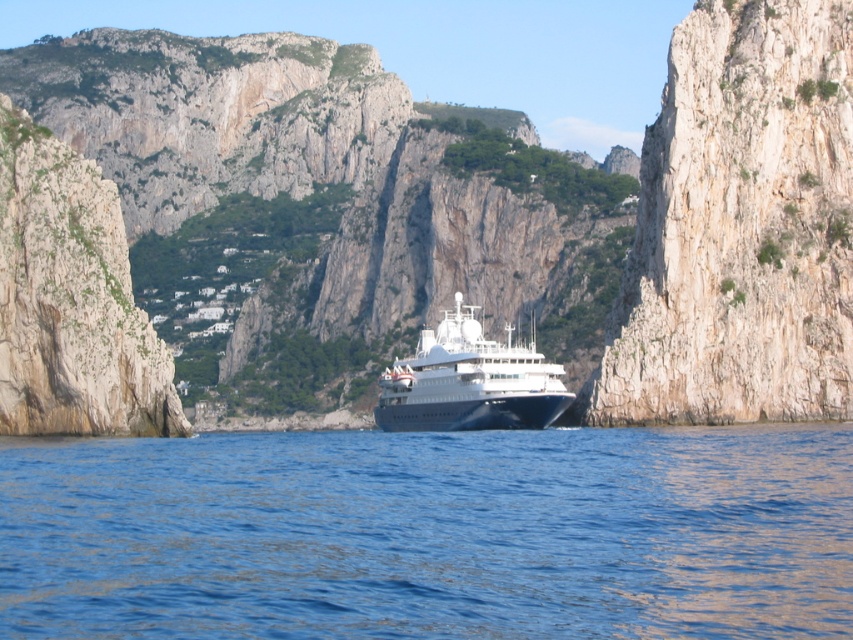
Question: Which object appears farthest from the camera in this image?

Choices:
 (A) blue liquid water at center
 (B) white stone mountain at center
 (C) white glossy cruise ship at center

Answer: (C)

Question: Where is white stone mountain at center located in relation to white glossy cruise ship at center in the image?

Choices:
 (A) above
 (B) below

Answer: (A)

Question: Which point is farther to the camera?

Choices:
 (A) (833, 58)
 (B) (457, 330)

Answer: (B)

Question: Which of the following is the farthest from the observer?

Choices:
 (A) (396, 595)
 (B) (766, 179)

Answer: (B)

Question: Does white stone mountain at center have a larger size compared to blue liquid water at center?

Choices:
 (A) yes
 (B) no

Answer: (A)

Question: Is blue liquid water at center thinner than white glossy cruise ship at center?

Choices:
 (A) no
 (B) yes

Answer: (A)